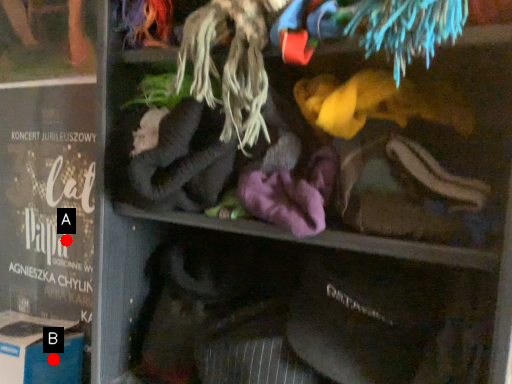
Question: Two points are circled on the image, labeled by A and B beside each circle. Which point is closer to the camera taking this photo?

Choices:
 (A) A is closer
 (B) B is closer

Answer: (B)